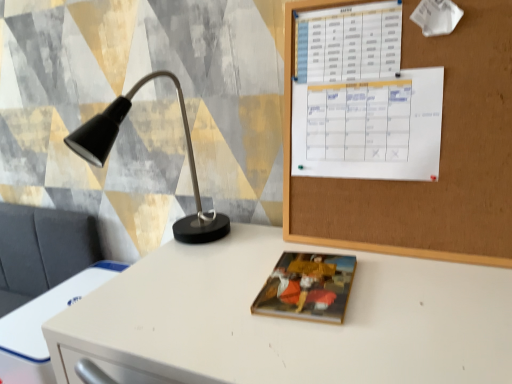
At what (x,y) coordinates should I click in order to perform the action: click on free space above matte paper book at center (from a real-world perspective). Please return your answer as a coordinate pair (x, y). This screenshot has height=384, width=512. Looking at the image, I should click on (306, 276).